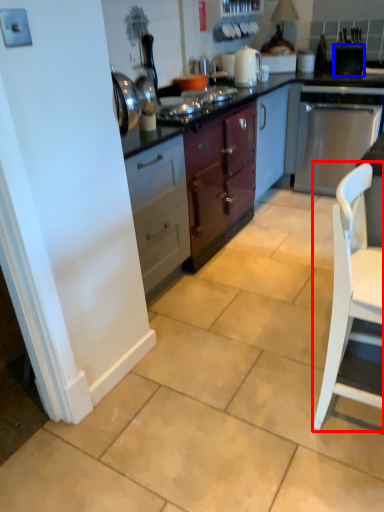
Question: Which object appears closest to the camera in this image, chair (highlighted by a red box) or appliance (highlighted by a blue box)?

Choices:
 (A) chair
 (B) appliance

Answer: (A)